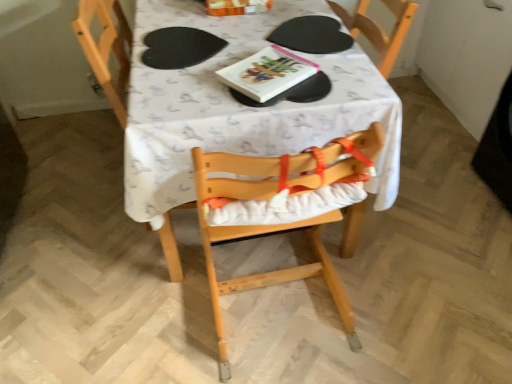
I want to click on free space that is to the left of natural wood highchair at center, so tap(153, 306).